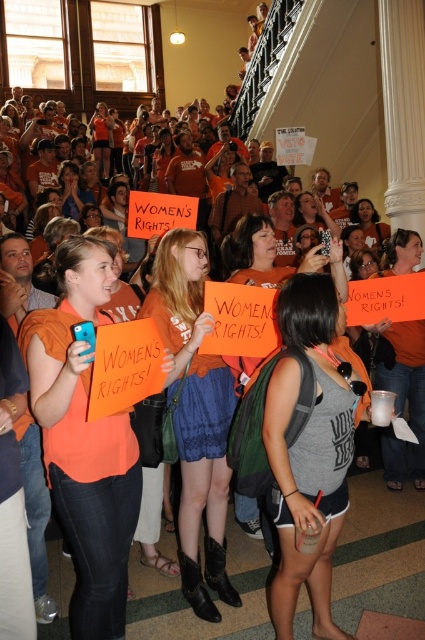
Question: Is orange matte sign at center thinner than matte orange shirt at upper center?

Choices:
 (A) no
 (B) yes

Answer: (B)

Question: Is orange matte shirt at center further to camera compared to matte orange shirt at upper center?

Choices:
 (A) no
 (B) yes

Answer: (A)

Question: Does orange matte shirt at center appear on the right side of orange matte sign at center?

Choices:
 (A) no
 (B) yes

Answer: (A)

Question: Estimate the real-world distances between objects in this image. Which object is closer to the orange matte sign at center?

Choices:
 (A) gray fabric backpack at center
 (B) gray cotton tank top at center
 (C) matte orange shirt at upper center
 (D) orange matte shirt at center

Answer: (A)

Question: Which point is closer to the camera?

Choices:
 (A) gray cotton tank top at center
 (B) orange matte sign at center
 (C) gray fabric backpack at center
 (D) orange matte shirt at center

Answer: (D)

Question: Which object is the closest to the gray cotton tank top at center?

Choices:
 (A) orange matte shirt at center
 (B) orange fabric shirt at center
 (C) matte orange shirt at upper center

Answer: (B)